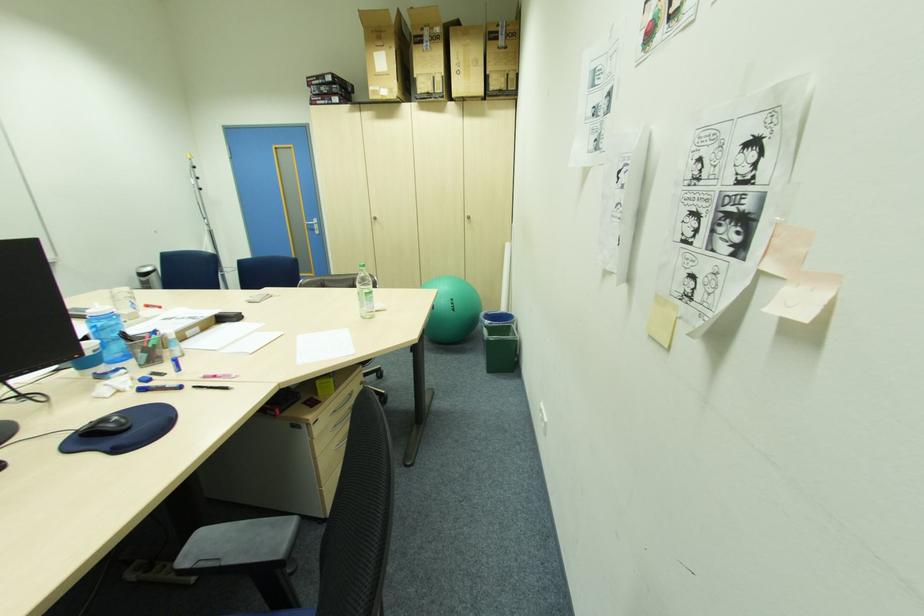
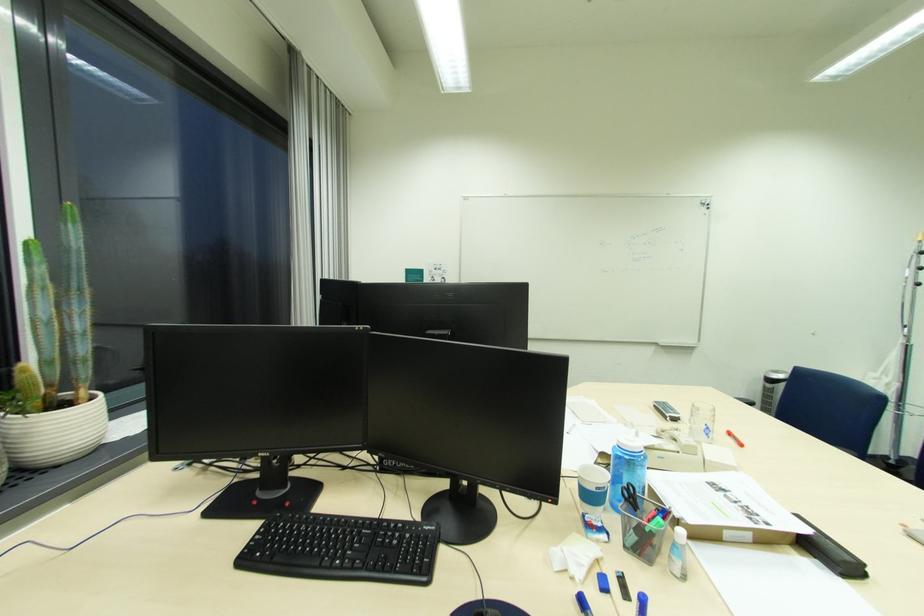
The point at [171,375] is marked in the first image. Where is the corresponding point in the second image?

(636, 601)